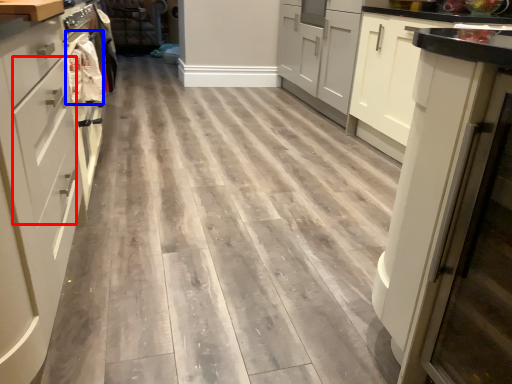
Question: Among these objects, which one is farthest to the camera, drawer (highlighted by a red box) or material (highlighted by a blue box)?

Choices:
 (A) drawer
 (B) material

Answer: (B)